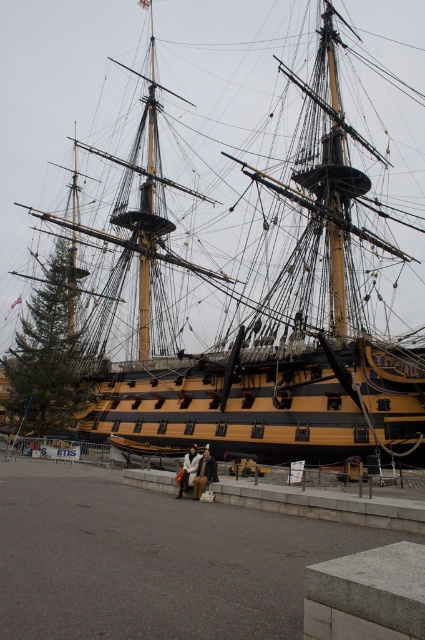
You are standing on the waterfront and see the yellow polished wood ship at center and the brown leather jacket at center. Which object is positioned more to the east? Please answer based on the scene description.

The yellow polished wood ship at center is to the right of brown leather jacket at center. Since the scene is viewed from a typical perspective where right corresponds to east, the yellow polished wood ship at center is positioned more to the east.

You are standing on the waterfront and notice both the yellow polished wood ship at center and the white wool coat at center. Which object is positioned higher in elevation?

The yellow polished wood ship at center is located above the white wool coat at center, so it is positioned higher in elevation.